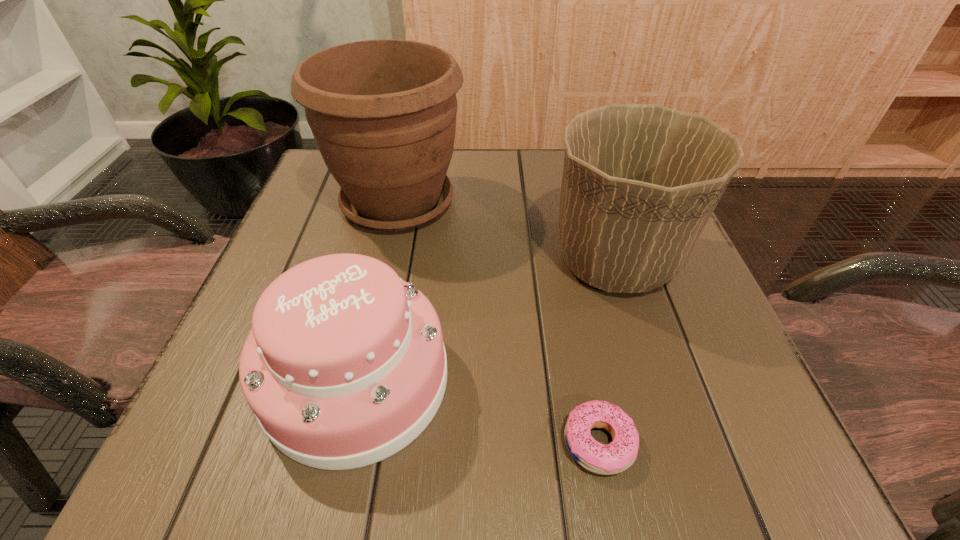
I want to click on free space between the doughnut and the left flowerpot, so click(x=498, y=322).

Locate which object ranks third in proximity to the left flowerpot. Please provide its 2D coordinates. Your answer should be formatted as a tuple, i.e. [(x, y)], where the tuple contains the x and y coordinates of a point satisfying the conditions above.

[(620, 454)]

This screenshot has height=540, width=960. I want to click on the closest object to the shorter flowerpot, so click(382, 112).

At what (x,y) coordinates should I click in order to perform the action: click on free location that satisfies the following two spatial constraints: 1. on the front side of the left flowerpot; 2. on the right side of the doughnut. Please return your answer as a coordinate pair (x, y). The width and height of the screenshot is (960, 540). Looking at the image, I should click on (344, 443).

What are the coordinates of `free region that satisfies the following two spatial constraints: 1. on the back side of the second shortest object; 2. on the right side of the left flowerpot` in the screenshot? It's located at (397, 202).

The image size is (960, 540). I want to click on free location that satisfies the following two spatial constraints: 1. on the back side of the right flowerpot; 2. on the left side of the cake, so click(x=384, y=260).